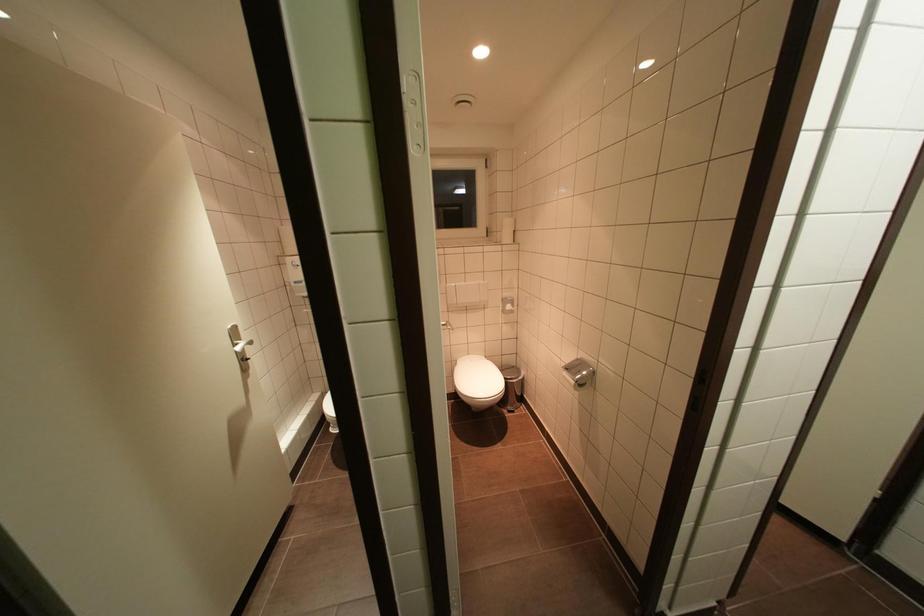
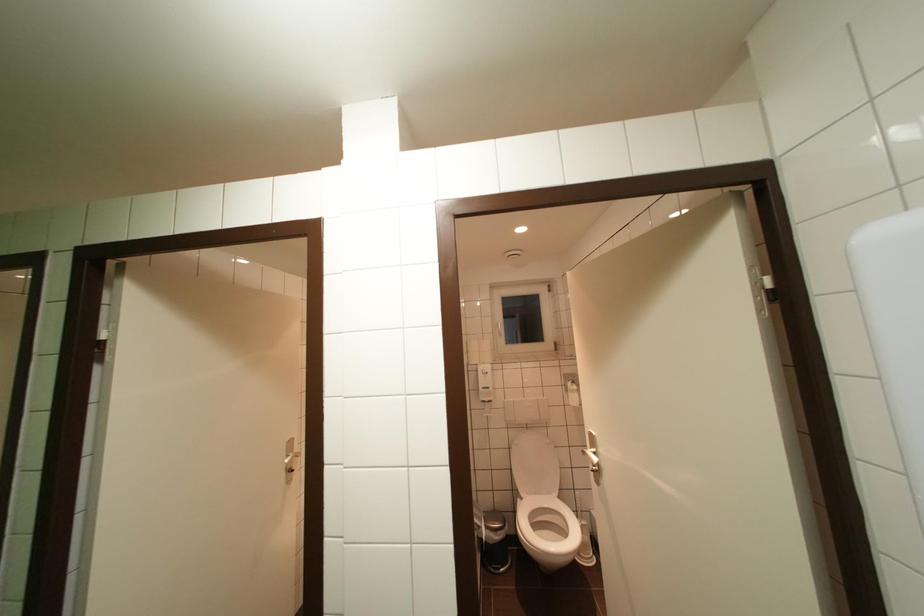
Question: The images are taken continuously from a first-person perspective. In which direction are you moving?

Choices:
 (A) Left
 (B) Right
 (C) Forward
 (D) Backward

Answer: (B)